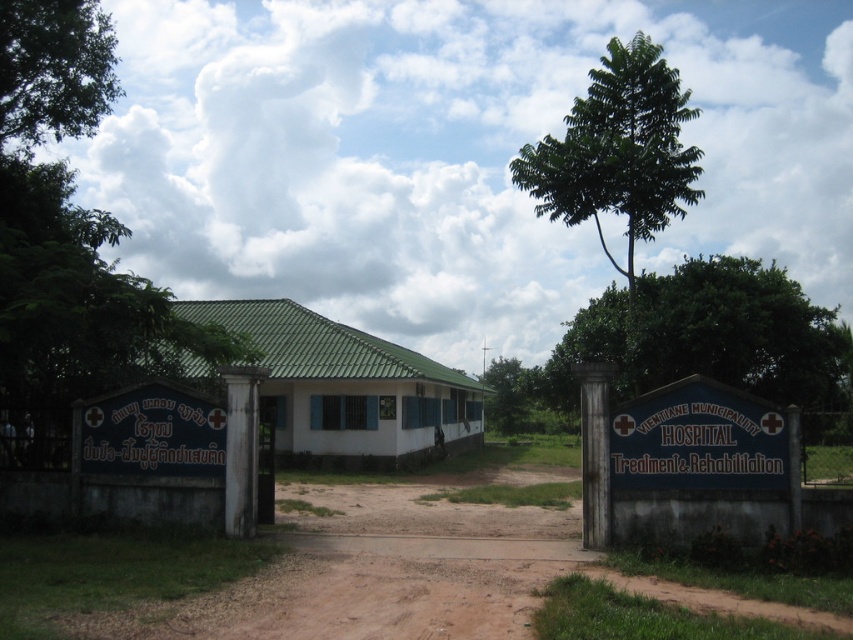
Question: Which object appears farthest from the camera in this image?

Choices:
 (A) green leafy tree at upper center
 (B) blue painted signboard at center

Answer: (A)

Question: Does green leafy tree at left have a smaller size compared to green leafy tree at upper center?

Choices:
 (A) yes
 (B) no

Answer: (A)

Question: Where is green leafy tree at center located in relation to blue painted signboard at center in the image?

Choices:
 (A) right
 (B) left

Answer: (A)

Question: Is brown dirt field at center closer to camera compared to blue painted signboard at center?

Choices:
 (A) no
 (B) yes

Answer: (B)

Question: Among these objects, which one is nearest to the camera?

Choices:
 (A) blue painted signboard at center
 (B) brown dirt field at center
 (C) green leafy tree at left
 (D) green leafy tree at upper center

Answer: (B)

Question: Estimate the real-world distances between objects in this image. Which object is closer to the blue painted signboard at center?

Choices:
 (A) green leafy tree at center
 (B) green leafy tree at upper center

Answer: (A)